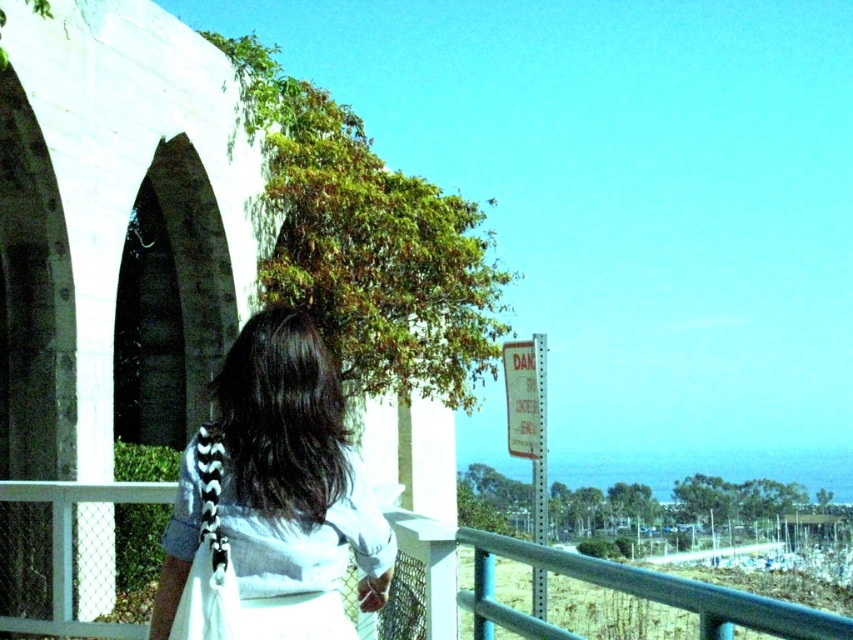
You are a photographer trying to capture the scene with the dark brown hair at center. If you want to focus on the person, where should you aim your camera?

You should aim your camera at point (277, 477) to focus on the dark brown hair at center.

You are a photographer trying to capture the scene with the dark brown hair at center and the smooth teal railing at center. If you want to include both in your shot, which object should you position closer to the left side of your camera frame?

The dark brown hair at center should be positioned closer to the left side of your camera frame because it is already located to the left of the smooth teal railing at center in the scene.